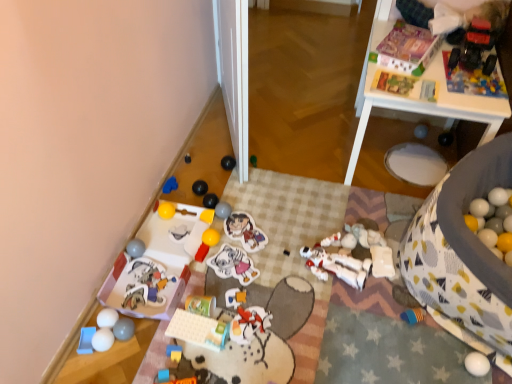
This screenshot has height=384, width=512. Find the location of `vacant area that is in front of matte plastic toy at lower left, which appears as the 22th toy when viewed from the right`. vacant area that is in front of matte plastic toy at lower left, which appears as the 22th toy when viewed from the right is located at coordinates pyautogui.click(x=131, y=337).